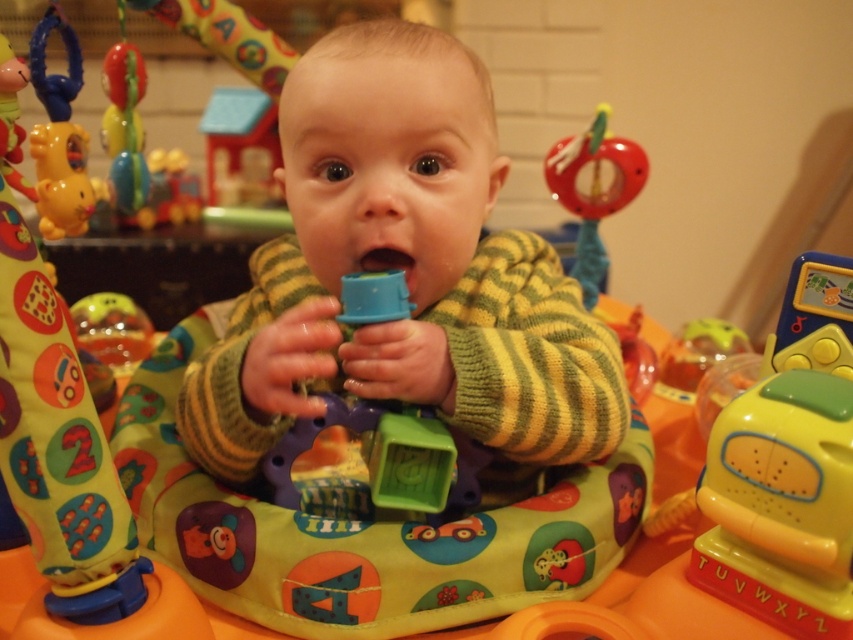
Can you confirm if knitted green sweater at center is wider than rubberized red teething ring at upper right?

Indeed, knitted green sweater at center has a greater width compared to rubberized red teething ring at upper right.

Who is taller, knitted green sweater at center or rubberized red teething ring at upper right?

Standing taller between the two is knitted green sweater at center.

Image resolution: width=853 pixels, height=640 pixels. I want to click on knitted green sweater at center, so click(416, 276).

Who is positioned more to the left, blue plastic cup at center or blue rubber mouth at center?

Positioned to the left is blue plastic cup at center.

Between point (434, 440) and point (398, 257), which one is positioned in front?

Point (434, 440) is more forward.

Image resolution: width=853 pixels, height=640 pixels. Identify the location of blue plastic cup at center. (376, 452).

This screenshot has height=640, width=853. In order to click on blue plastic cup at center in this screenshot , I will do `click(376, 452)`.

Where is `blue plastic cup at center`? This screenshot has height=640, width=853. blue plastic cup at center is located at coordinates (376, 452).